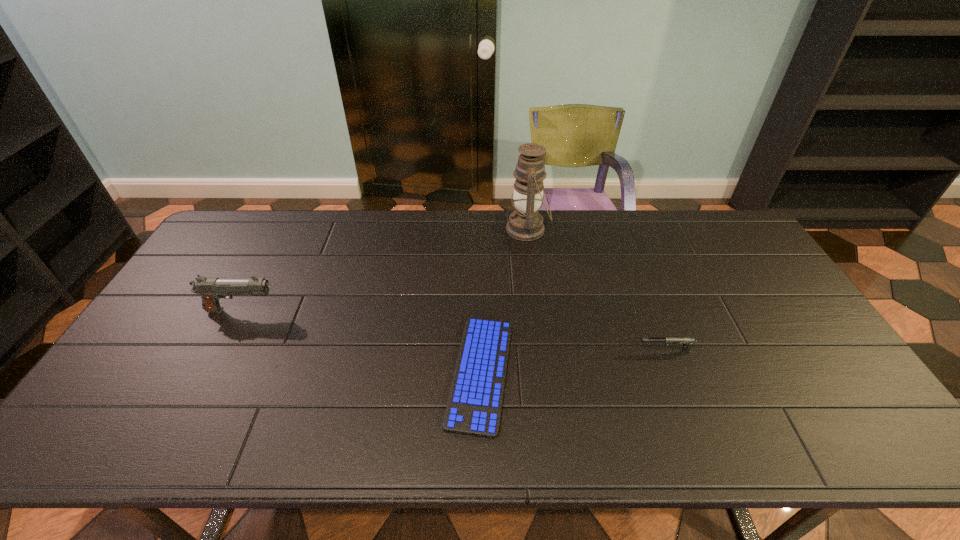
In the image, there is a desktop. Where is `vacant area at the right edge`? The width and height of the screenshot is (960, 540). vacant area at the right edge is located at coordinates (784, 371).

In the image, there is a desktop. Identify the location of vacant area at the far right corner. (728, 224).

I want to click on vacant region between the taller gun and the shortest object, so click(x=361, y=342).

The width and height of the screenshot is (960, 540). I want to click on vacant region between the computer keyboard and the left gun, so click(361, 342).

The image size is (960, 540). Identify the location of vacant space that is in between the oil lamp and the shortest object. (504, 301).

The height and width of the screenshot is (540, 960). I want to click on empty space that is in between the computer keyboard and the shorter gun, so click(x=573, y=363).

Where is `vacant area that lies between the oil lamp and the leftmost object`? This screenshot has width=960, height=540. vacant area that lies between the oil lamp and the leftmost object is located at coordinates (385, 270).

Find the location of a particular element. The image size is (960, 540). vacant area that lies between the leftmost object and the second shortest object is located at coordinates (453, 331).

Locate an element on the screen. Image resolution: width=960 pixels, height=540 pixels. empty space between the taller gun and the oil lamp is located at coordinates (385, 270).

Locate an element on the screen. free space between the farther gun and the rightmost object is located at coordinates (453, 331).